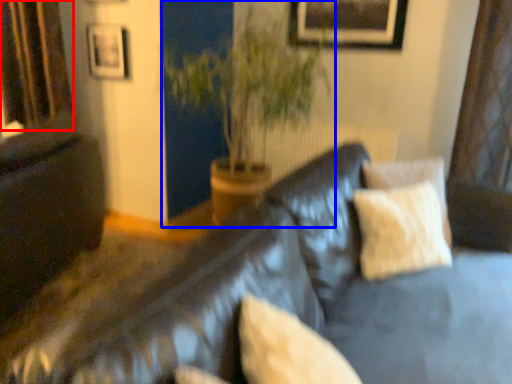
Question: Which of the following is the farthest to the observer, curtain (highlighted by a red box) or houseplant (highlighted by a blue box)?

Choices:
 (A) curtain
 (B) houseplant

Answer: (A)